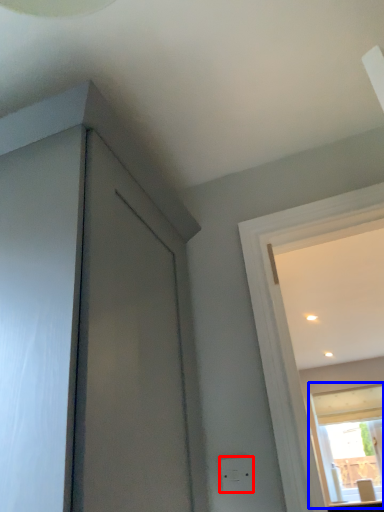
Question: Which point is further to the camera, electric outlet (highlighted by a red box) or window (highlighted by a blue box)?

Choices:
 (A) electric outlet
 (B) window

Answer: (B)